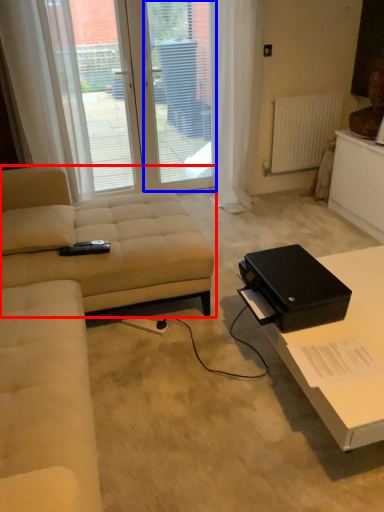
Question: Which point is closer to the camera, studio couch (highlighted by a red box) or screen door (highlighted by a blue box)?

Choices:
 (A) studio couch
 (B) screen door

Answer: (A)